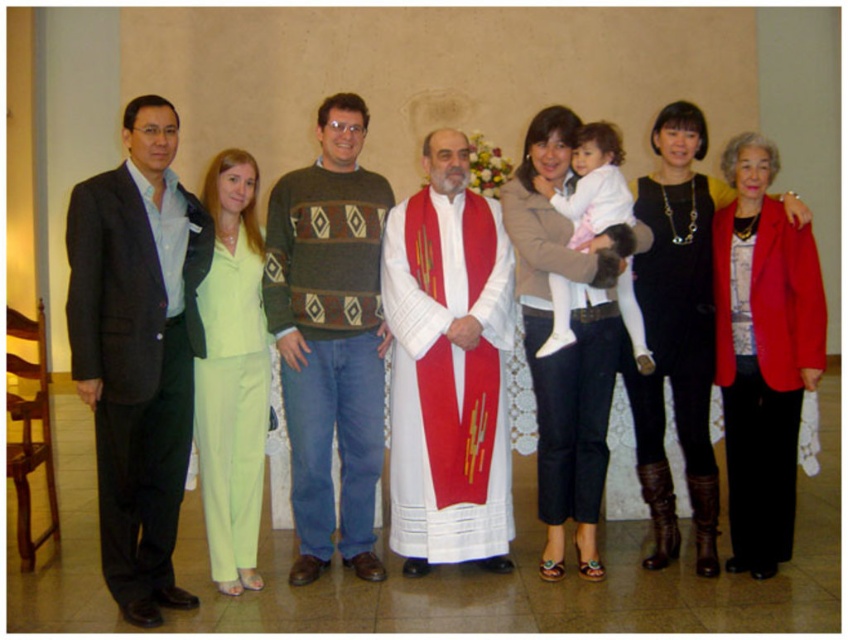
You are a photographer trying to adjust the lighting for a group photo. You notice the dark gray suit at left and linen green pants at center. Which clothing item is positioned higher in the frame?

The dark gray suit at left is much taller than the linen green pants at center, so it is positioned higher in the frame.